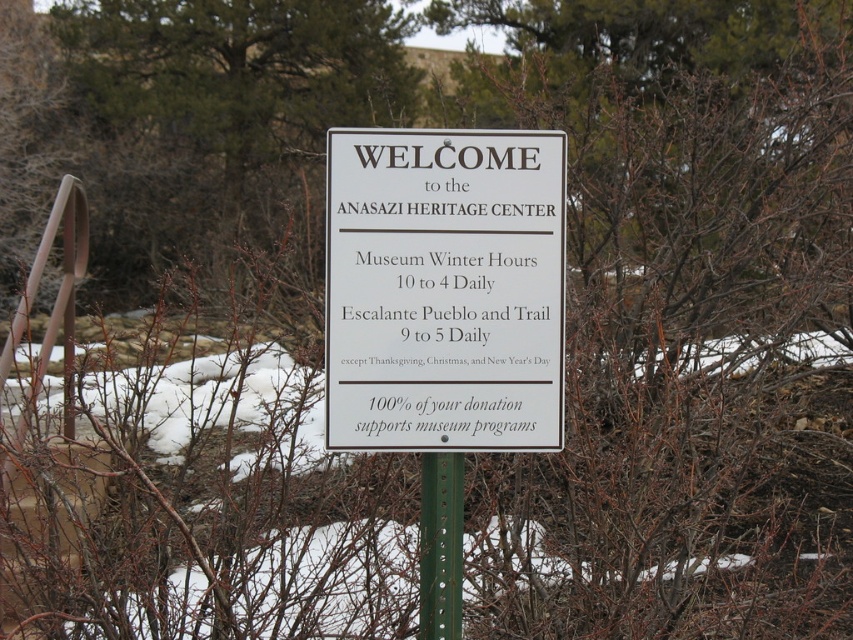
You are standing at the entrance of the Anasazi Heritage Center and see two points on the signboard. The first point is at coordinates point (x=473, y=384) and the second point is at point (x=424, y=588). From your perspective, which point is closer to you?

Point (x=473, y=384) is in front of point (x=424, y=588), so the first point is closer to you.

You are standing at the entrance of the Anasazi Heritage Center and want to touch the signboard. The point you want to reach is at coordinate point (540, 397). If your arm can reach up to 2 meters, can you reach that point?

The distance of point (540, 397) from viewer is 2.70 meters, so you cannot reach it since your arm can only reach up to 2 meters.